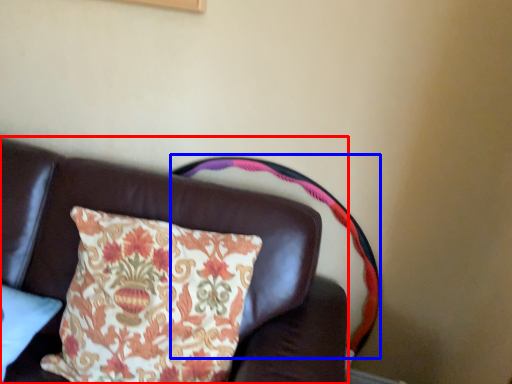
Question: Which object is further to the camera taking this photo, furniture (highlighted by a red box) or swivel chair (highlighted by a blue box)?

Choices:
 (A) furniture
 (B) swivel chair

Answer: (B)